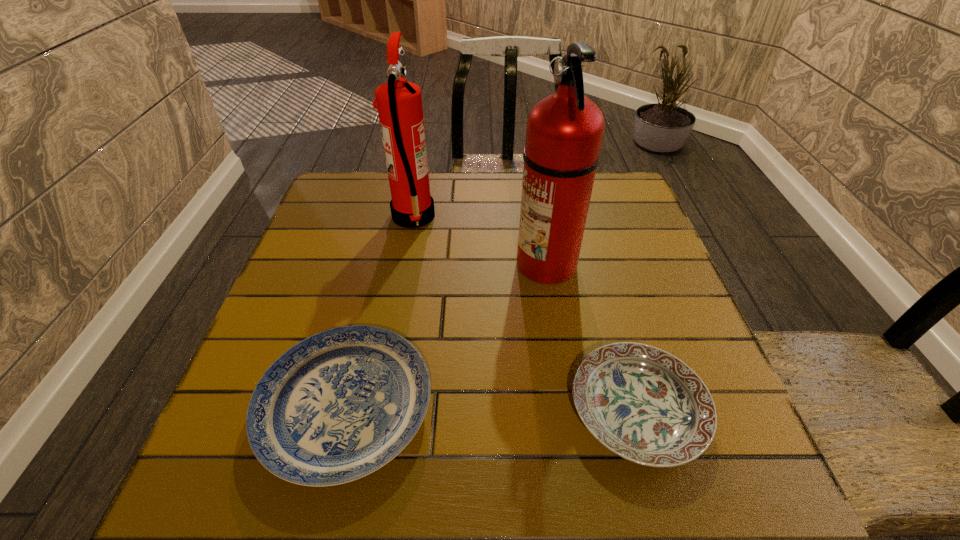
Image resolution: width=960 pixels, height=540 pixels. I want to click on free spot located on the left of the right plate, so click(x=467, y=410).

The height and width of the screenshot is (540, 960). Identify the location of object located in the far edge section of the desktop. (399, 103).

Image resolution: width=960 pixels, height=540 pixels. In order to click on object situated at the left edge in this screenshot , I will do `click(337, 406)`.

At what (x,y) coordinates should I click in order to perform the action: click on object at the right edge. Please return your answer as a coordinate pair (x, y). This screenshot has width=960, height=540. Looking at the image, I should click on (642, 403).

You are a GUI agent. You are given a task and a screenshot of the screen. Output one action in this format:
    pyautogui.click(x=<x>, y=<y>)
    Task: Click on the object positioned at the near left corner
    The height and width of the screenshot is (540, 960).
    Given the screenshot: What is the action you would take?
    pyautogui.click(x=337, y=406)

What are the coordinates of `object situated at the near right corner` in the screenshot? It's located at (642, 403).

At what (x,y) coordinates should I click in order to perform the action: click on blank space at the near edge of the desktop. Please return your answer as a coordinate pair (x, y). Looking at the image, I should click on (579, 503).

Locate an element on the screen. The height and width of the screenshot is (540, 960). free space at the left edge is located at coordinates (353, 283).

Locate an element on the screen. free space at the right edge of the desktop is located at coordinates (724, 404).

In the image, there is a desktop. Where is `vacant space at the far left corner`? vacant space at the far left corner is located at coordinates (350, 194).